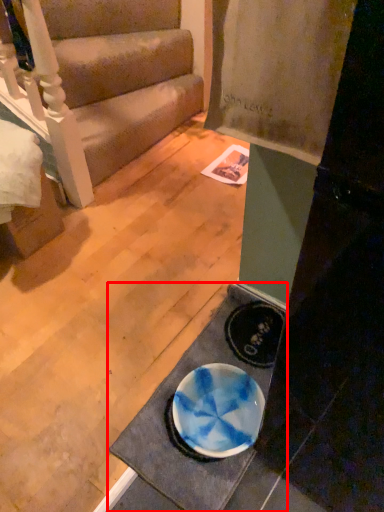
Question: From the image's perspective, where is doormat (annotated by the red box) located relative to studio couch?

Choices:
 (A) above
 (B) below

Answer: (B)